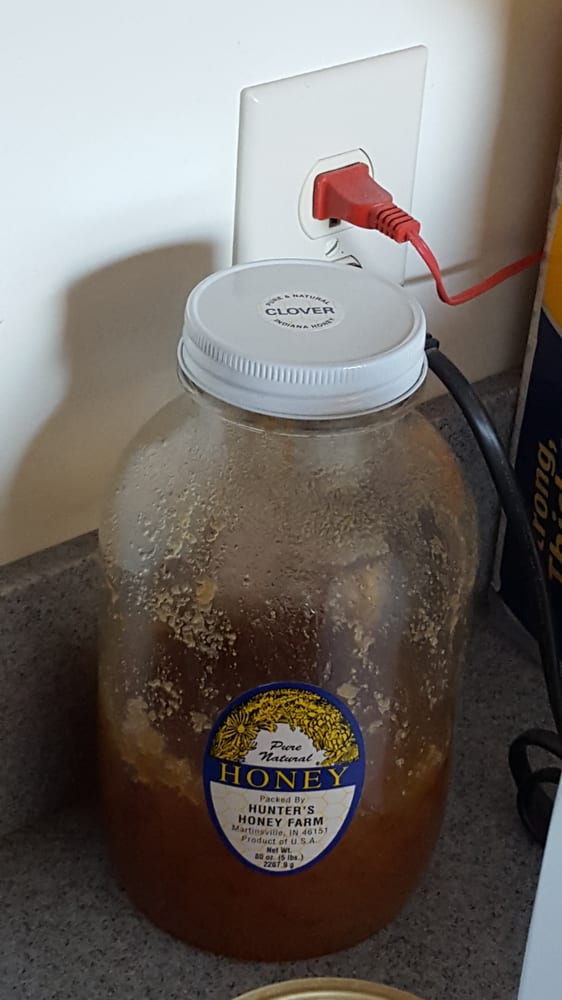
At what (x,y) coordinates should I click in order to perform the action: click on outlet. Please return your answer as a coordinate pair (x, y). Looking at the image, I should click on (266, 154).